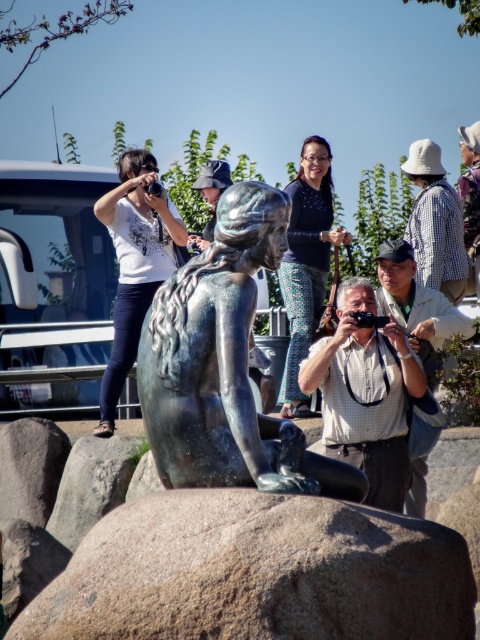
What do you see at coordinates (435, 224) in the screenshot? The image size is (480, 640). I see `white checkered shirt at upper right` at bounding box center [435, 224].

How far apart are white checkered shirt at upper right and matte bronze statue at center?

white checkered shirt at upper right and matte bronze statue at center are 41.57 feet apart from each other.

This screenshot has height=640, width=480. What are the coordinates of `white checkered shirt at upper right` in the screenshot? It's located at (435, 224).

Is blue textured sweater at center thinner than plaid shirt at center?

Correct, blue textured sweater at center's width is less than plaid shirt at center's.

Where is `blue textured sweater at center`? The height and width of the screenshot is (640, 480). blue textured sweater at center is located at coordinates (307, 262).

Identify the location of blue textured sweater at center. The width and height of the screenshot is (480, 640). (307, 262).

Is brown granite boulder at center smaller than white matte shirt at upper left?

Indeed, brown granite boulder at center has a smaller size compared to white matte shirt at upper left.

What do you see at coordinates (256, 573) in the screenshot?
I see `brown granite boulder at center` at bounding box center [256, 573].

The height and width of the screenshot is (640, 480). In order to click on brown granite boulder at center in this screenshot , I will do `click(256, 573)`.